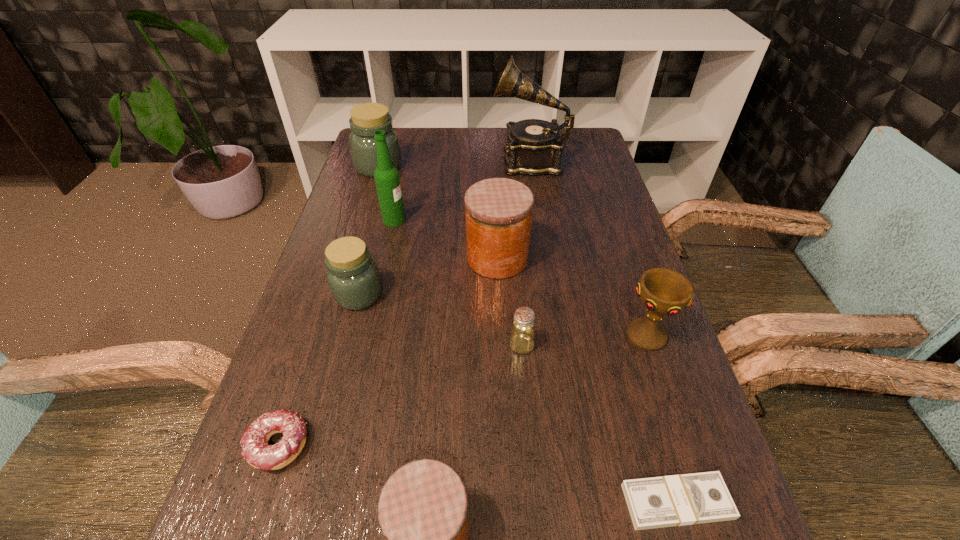
Image resolution: width=960 pixels, height=540 pixels. In order to click on vacant space in between the smaller green jar and the saltshaker in this screenshot , I will do `click(440, 320)`.

This screenshot has height=540, width=960. What are the coordinates of `empty space between the second shortest object and the beer bottle` in the screenshot? It's located at (337, 333).

In order to click on free space between the shortest object and the beer bottle in this screenshot , I will do `click(536, 361)`.

Find the location of a particular element. object that can be found as the sixth closest to the tallest object is located at coordinates (521, 341).

Locate which object ranks seventh in proximity to the eighth nearest object. Please provide its 2D coordinates. Your answer should be formatted as a tuple, i.e. [(x, y)], where the tuple contains the x and y coordinates of a point satisfying the conditions above.

[(663, 291)]

At what (x,y) coordinates should I click in order to perform the action: click on jar object that ranks as the second closest to the shortest object. Please return your answer as a coordinate pair (x, y). Looking at the image, I should click on (499, 211).

Locate an element on the screen. The image size is (960, 540). jar object that ranks as the third closest to the tallest object is located at coordinates (353, 277).

Identify the location of free point that satisfies the following two spatial constraints: 1. on the back side of the nearer green jar; 2. on the left side of the pink doughnut. (328, 295).

Identify the location of vacant space that satisfies the following two spatial constraints: 1. on the horn of the red chalice; 2. on the right side of the tallest object. point(557,336).

The width and height of the screenshot is (960, 540). I want to click on free space that satisfies the following two spatial constraints: 1. on the front side of the eighth tallest object; 2. on the left side of the bigger green jar, so click(324, 345).